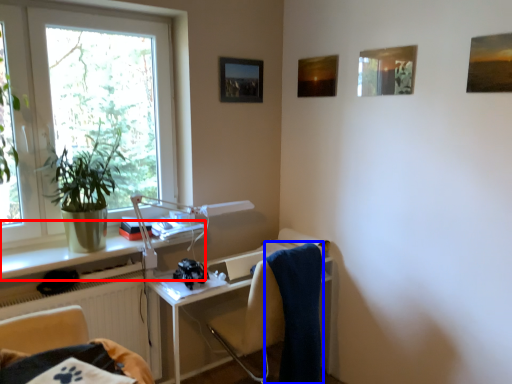
Question: Which of the following is the farthest to the observer, window sill (highlighted by a red box) or bath towel (highlighted by a blue box)?

Choices:
 (A) window sill
 (B) bath towel

Answer: (B)